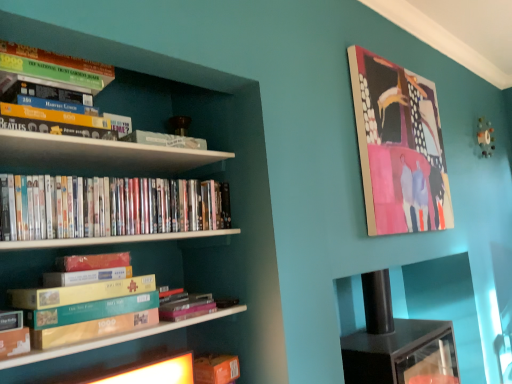
The image size is (512, 384). What do you see at coordinates (443, 304) in the screenshot? I see `black glossy cabinet at lower right` at bounding box center [443, 304].

This screenshot has width=512, height=384. Find the location of `orange cardboard box at lower left, positioned as the 1th book in bottom-to-top order`. orange cardboard box at lower left, positioned as the 1th book in bottom-to-top order is located at coordinates point(216,369).

I want to click on matte plastic dvds at left, the 2th book viewed from the top, so click(x=106, y=206).

I want to click on teal cardboard box at lower left, which ranks as the 3th book in top-to-bottom order, so click(x=90, y=320).

Image resolution: width=512 pixels, height=384 pixels. Describe the element at coordinates (200, 178) in the screenshot. I see `white glossy bookshelf at left` at that location.

I want to click on green cardboard book at upper left, which is counted as the fifth book, starting from the bottom, so click(55, 68).

The image size is (512, 384). I want to click on hardcover book at center, arranged as the second book when ordered from the bottom, so click(186, 306).

I want to click on black glossy cabinet at lower right, so pyautogui.click(x=443, y=304).

Can you confirm if matte wooden picture frame at upper right is bigger than black glossy cabinet at lower right?

No, matte wooden picture frame at upper right is not bigger than black glossy cabinet at lower right.

In the image, is matte wooden picture frame at upper right positioned in front of or behind black glossy cabinet at lower right?

In the image, matte wooden picture frame at upper right appears behind black glossy cabinet at lower right.

Identify the location of picture frame on the right of the black glossy cabinet at lower right. Image resolution: width=512 pixels, height=384 pixels. (399, 147).

Is matte wooden picture frame at upper right facing towards black glossy cabinet at lower right?

No, matte wooden picture frame at upper right is not facing towards black glossy cabinet at lower right.

Which is in front, teal cardboard box at lower left, which ranks as the 3th book in top-to-bottom order, or green cardboard book at upper left, which appears as the first book when viewed from the top?

Positioned in front is teal cardboard box at lower left, which ranks as the 3th book in top-to-bottom order.

From a real-world perspective, is teal cardboard box at lower left, which is the third book from bottom to top, physically above green cardboard book at upper left, which appears as the first book when viewed from the top?

Incorrect, from a real-world perspective, teal cardboard box at lower left, which is the third book from bottom to top, is lower than green cardboard book at upper left, which appears as the first book when viewed from the top.

In terms of size, does teal cardboard box at lower left, which ranks as the 3th book in top-to-bottom order, appear bigger or smaller than green cardboard book at upper left, which appears as the first book when viewed from the top?

Clearly, teal cardboard box at lower left, which ranks as the 3th book in top-to-bottom order, is smaller in size than green cardboard book at upper left, which appears as the first book when viewed from the top.

Is teal cardboard box at lower left, which is the third book from bottom to top, surrounding green cardboard book at upper left, which is counted as the fifth book, starting from the bottom?

No, teal cardboard box at lower left, which is the third book from bottom to top, does not contain green cardboard book at upper left, which is counted as the fifth book, starting from the bottom.

Which of these two, white glossy bookshelf at left or hardcover book at center, placed as the 4th book when sorted from top to bottom, is wider?

white glossy bookshelf at left.

From a real-world perspective, is white glossy bookshelf at left located beneath hardcover book at center, placed as the 4th book when sorted from top to bottom?

No.

This screenshot has height=384, width=512. I want to click on bookcase lying above the hardcover book at center, arranged as the second book when ordered from the bottom (from the image's perspective), so click(200, 178).

In the scene shown: Which object is further away from the camera, white glossy bookshelf at left or hardcover book at center, arranged as the second book when ordered from the bottom?

hardcover book at center, arranged as the second book when ordered from the bottom, is further from the camera.

Between green cardboard book at upper left, which appears as the first book when viewed from the top, and black glossy cabinet at lower right, which one has more height?

Standing taller between the two is black glossy cabinet at lower right.

Does point (34, 55) come closer to viewer compared to point (460, 260)?

Yes.

From the picture: Does green cardboard book at upper left, which appears as the first book when viewed from the top, have a smaller size compared to black glossy cabinet at lower right?

Correct, green cardboard book at upper left, which appears as the first book when viewed from the top, occupies less space than black glossy cabinet at lower right.

From the picture: What's the angular difference between green cardboard book at upper left, which is counted as the fifth book, starting from the bottom, and black glossy cabinet at lower right's facing directions?

The angular difference between green cardboard book at upper left, which is counted as the fifth book, starting from the bottom, and black glossy cabinet at lower right is 5.84 degrees.

Is white glossy bookshelf at left located within matte wooden picture frame at upper right?

No.

Can you confirm if matte wooden picture frame at upper right is taller than white glossy bookshelf at left?

No.

From a real-world perspective, relative to white glossy bookshelf at left, is matte wooden picture frame at upper right vertically above or below?

matte wooden picture frame at upper right is above white glossy bookshelf at left.

Is matte wooden picture frame at upper right positioned behind white glossy bookshelf at left?

Yes.

Is the position of green cardboard book at upper left, which appears as the first book when viewed from the top, less distant than that of orange cardboard box at lower left, positioned as the 5th book in top-to-bottom order?

Yes, it is.

Does green cardboard book at upper left, which is counted as the fifth book, starting from the bottom, contain orange cardboard box at lower left, positioned as the 1th book in bottom-to-top order?

No.

Is green cardboard book at upper left, which appears as the first book when viewed from the top, oriented towards orange cardboard box at lower left, positioned as the 5th book in top-to-bottom order?

No, green cardboard book at upper left, which appears as the first book when viewed from the top, is not aimed at orange cardboard box at lower left, positioned as the 5th book in top-to-bottom order.

Where is `the 4th book to the left of the orange cardboard box at lower left, positioned as the 1th book in bottom-to-top order, starting your count from the anchor`? the 4th book to the left of the orange cardboard box at lower left, positioned as the 1th book in bottom-to-top order, starting your count from the anchor is located at coordinates (55, 68).

Considering the relative positions of hardcover book at center, placed as the 4th book when sorted from top to bottom, and matte wooden picture frame at upper right in the image provided, is hardcover book at center, placed as the 4th book when sorted from top to bottom, to the left of matte wooden picture frame at upper right from the viewer's perspective?

Yes, hardcover book at center, placed as the 4th book when sorted from top to bottom, is to the left of matte wooden picture frame at upper right.

Is hardcover book at center, placed as the 4th book when sorted from top to bottom, located outside matte wooden picture frame at upper right?

Yes, hardcover book at center, placed as the 4th book when sorted from top to bottom, is outside of matte wooden picture frame at upper right.

Where is `picture frame on the right of the black glossy cabinet at lower right`? This screenshot has width=512, height=384. picture frame on the right of the black glossy cabinet at lower right is located at coordinates (399, 147).

You are a GUI agent. You are given a task and a screenshot of the screen. Output one action in this format:
    pyautogui.click(x=<x>, y=<y>)
    Task: Click on the 1st book in front of the green cardboard book at upper left, which appears as the first book when viewed from the top
    Image resolution: width=512 pixels, height=384 pixels.
    Given the screenshot: What is the action you would take?
    pyautogui.click(x=90, y=320)

When comparing their distances from black glossy cabinet at lower right, does teal cardboard box at lower left, which ranks as the 3th book in top-to-bottom order, or white glossy bookshelf at left seem further?

teal cardboard box at lower left, which ranks as the 3th book in top-to-bottom order.

When comparing their distances from orange cardboard box at lower left, positioned as the 5th book in top-to-bottom order, does matte wooden picture frame at upper right or teal cardboard box at lower left, which ranks as the 3th book in top-to-bottom order, seem further?

Among the two, matte wooden picture frame at upper right is located further to orange cardboard box at lower left, positioned as the 5th book in top-to-bottom order.

Based on their spatial positions, is green cardboard book at upper left, which is counted as the fifth book, starting from the bottom, or orange cardboard box at lower left, positioned as the 1th book in bottom-to-top order, closer to hardcover book at center, placed as the 4th book when sorted from top to bottom?

Based on the image, orange cardboard box at lower left, positioned as the 1th book in bottom-to-top order, appears to be nearer to hardcover book at center, placed as the 4th book when sorted from top to bottom.

Based on their spatial positions, is black glossy cabinet at lower right or teal cardboard box at lower left, which ranks as the 3th book in top-to-bottom order, closer to hardcover book at center, placed as the 4th book when sorted from top to bottom?

teal cardboard box at lower left, which ranks as the 3th book in top-to-bottom order, lies closer to hardcover book at center, placed as the 4th book when sorted from top to bottom, than the other object.

When comparing their distances from orange cardboard box at lower left, positioned as the 1th book in bottom-to-top order, does black glossy cabinet at lower right or matte wooden picture frame at upper right seem closer?

Based on the image, matte wooden picture frame at upper right appears to be nearer to orange cardboard box at lower left, positioned as the 1th book in bottom-to-top order.

Considering their positions, is green cardboard book at upper left, which appears as the first book when viewed from the top, positioned further to teal cardboard box at lower left, which is the third book from bottom to top, than black glossy cabinet at lower right?

The object further to teal cardboard box at lower left, which is the third book from bottom to top, is black glossy cabinet at lower right.

Looking at the image, which one is located closer to orange cardboard box at lower left, positioned as the 5th book in top-to-bottom order, black glossy cabinet at lower right or green cardboard book at upper left, which is counted as the fifth book, starting from the bottom?

green cardboard book at upper left, which is counted as the fifth book, starting from the bottom.

When comparing their distances from white glossy bookshelf at left, does teal cardboard box at lower left, which is the third book from bottom to top, or black glossy cabinet at lower right seem closer?

The object closer to white glossy bookshelf at left is teal cardboard box at lower left, which is the third book from bottom to top.

You are a GUI agent. You are given a task and a screenshot of the screen. Output one action in this format:
    pyautogui.click(x=<x>, y=<y>)
    Task: Click on the cabinet between teal cardboard box at lower left, which is the third book from bottom to top, and matte wooden picture frame at upper right from left to right
    The height and width of the screenshot is (384, 512).
    Given the screenshot: What is the action you would take?
    pyautogui.click(x=443, y=304)

At what (x,y) coordinates should I click in order to perform the action: click on cabinet between hardcover book at center, placed as the 4th book when sorted from top to bottom, and matte wooden picture frame at upper right from left to right. Please return your answer as a coordinate pair (x, y). Looking at the image, I should click on (443, 304).

Locate an element on the screen. This screenshot has width=512, height=384. bookcase between green cardboard book at upper left, which is counted as the fifth book, starting from the bottom, and teal cardboard box at lower left, which is the third book from bottom to top, vertically is located at coordinates [x=200, y=178].

This screenshot has height=384, width=512. I want to click on bookcase between green cardboard book at upper left, which appears as the first book when viewed from the top, and black glossy cabinet at lower right from left to right, so click(200, 178).